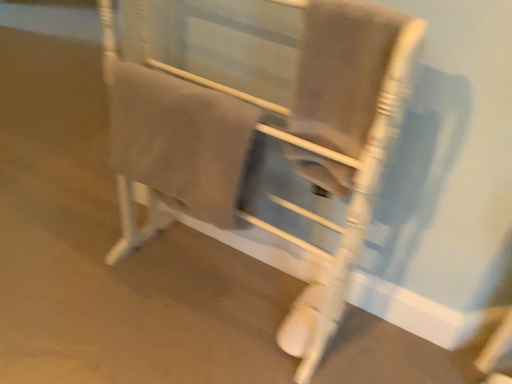
Question: Considering the positions of point (247, 178) and point (221, 140), is point (247, 178) closer or farther from the camera than point (221, 140)?

Choices:
 (A) farther
 (B) closer

Answer: (A)

Question: Is matte white chair at center to the left or to the right of beige cotton towel at center in the image?

Choices:
 (A) right
 (B) left

Answer: (A)

Question: Considering the positions of matte white chair at center and beige cotton towel at center in the image, is matte white chair at center wider or thinner than beige cotton towel at center?

Choices:
 (A) thin
 (B) wide

Answer: (B)

Question: From the image's perspective, is beige cotton towel at center located above or below matte white chair at center?

Choices:
 (A) above
 (B) below

Answer: (A)

Question: Is point (245, 180) closer or farther from the camera than point (141, 132)?

Choices:
 (A) farther
 (B) closer

Answer: (A)

Question: In terms of height, does beige cotton towel at center look taller or shorter compared to matte white chair at center?

Choices:
 (A) short
 (B) tall

Answer: (A)

Question: Is beige cotton towel at center wider or thinner than matte white chair at center?

Choices:
 (A) thin
 (B) wide

Answer: (A)